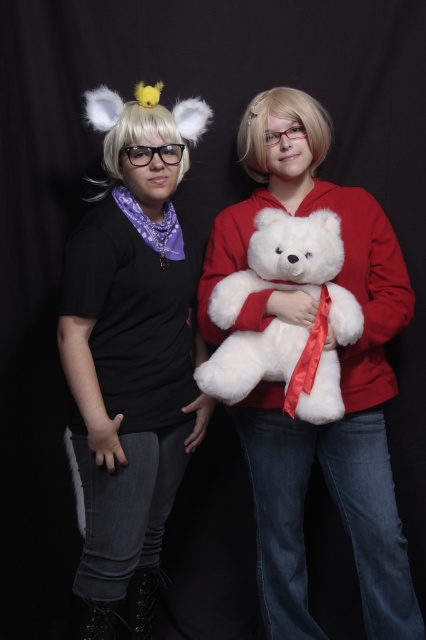
Question: Is fuzzy white wig at left closer to the viewer compared to white plush bear at center?

Choices:
 (A) no
 (B) yes

Answer: (A)

Question: Can you confirm if fuzzy white wig at left is wider than white plush bear at center?

Choices:
 (A) no
 (B) yes

Answer: (A)

Question: Which point is closer to the camera?

Choices:
 (A) (330, 381)
 (B) (146, 314)

Answer: (A)

Question: Which point appears closest to the camera in this image?

Choices:
 (A) (328, 300)
 (B) (140, 348)

Answer: (A)

Question: Can you confirm if fuzzy white wig at left is positioned above white plush bear at center?

Choices:
 (A) no
 (B) yes

Answer: (A)